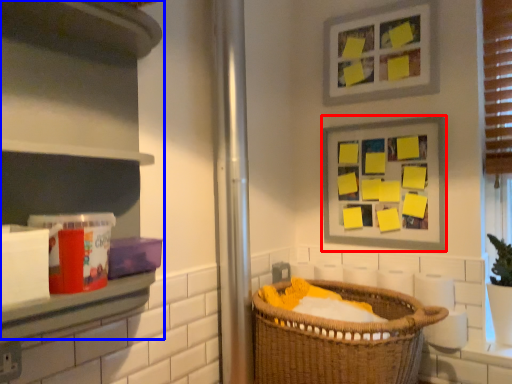
Question: Among these objects, which one is farthest to the camera, picture frame (highlighted by a red box) or cabinet (highlighted by a blue box)?

Choices:
 (A) picture frame
 (B) cabinet

Answer: (A)